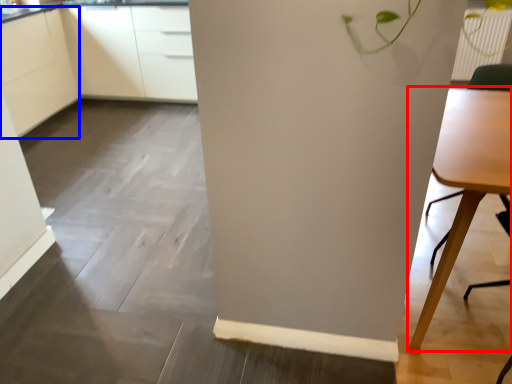
Question: Which object appears closest to the camera in this image, table (highlighted by a red box) or cabinetry (highlighted by a blue box)?

Choices:
 (A) table
 (B) cabinetry

Answer: (A)